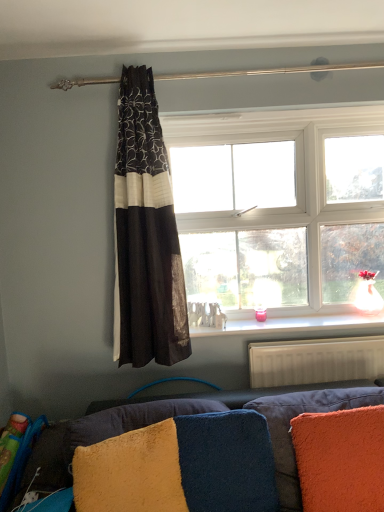
Identify the location of free space above white glossy window sill at center (from a real-world perspective). The width and height of the screenshot is (384, 512). (288, 321).